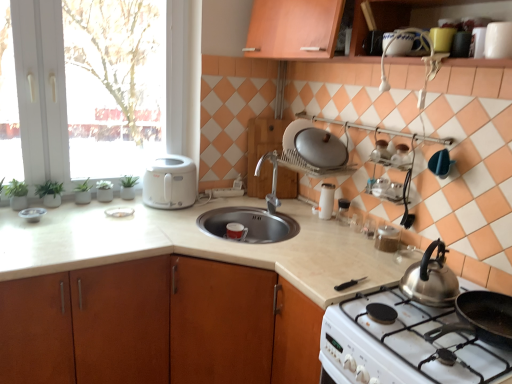
Locate an element on the screen. unoccupied space behind white glossy plate at left, which is the second appliance from left to right is located at coordinates (124, 200).